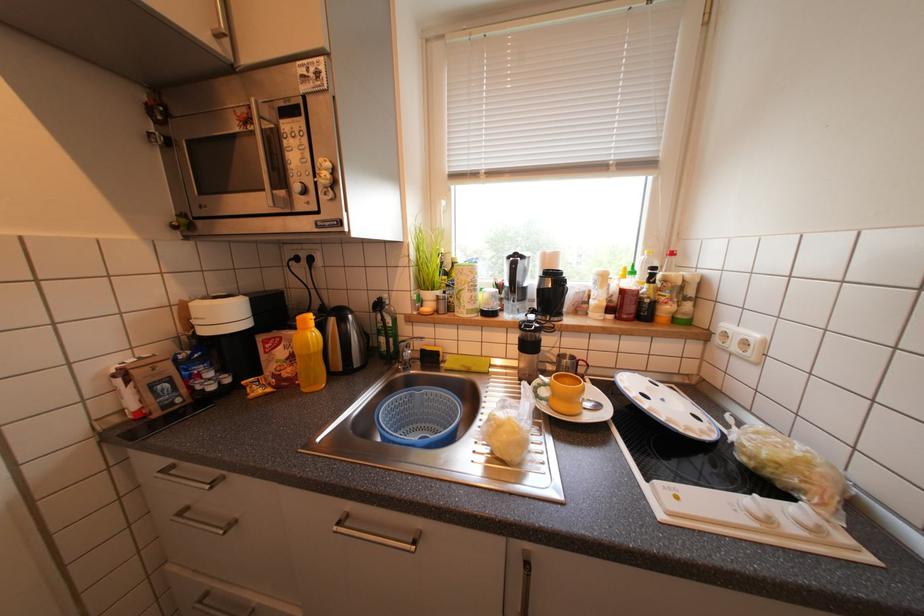
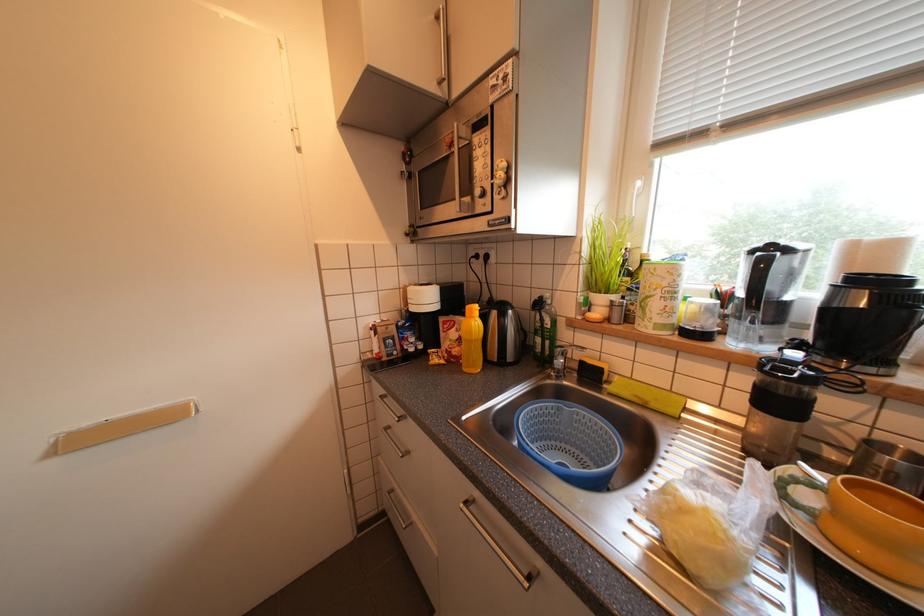
Question: How did the camera likely rotate?

Choices:
 (A) Left
 (B) Right
 (C) Up
 (D) Down

Answer: (A)